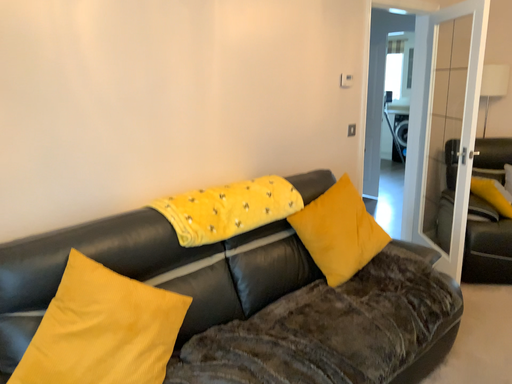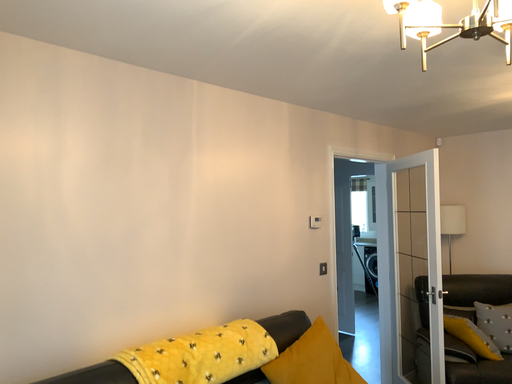
Question: How did the camera likely rotate when shooting the video?

Choices:
 (A) rotated upward
 (B) rotated downward

Answer: (A)